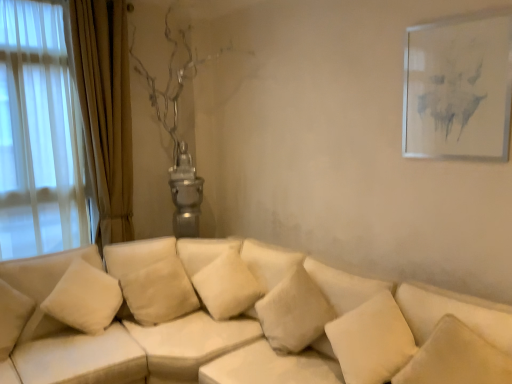
Question: Is soft beige cushion at center, which ranks as the third pillow in right-to-left order, taller than white fabric couch at center?

Choices:
 (A) yes
 (B) no

Answer: (B)

Question: Could you tell me if soft beige cushion at center, which ranks as the third pillow in right-to-left order, is turned towards white fabric couch at center?

Choices:
 (A) yes
 (B) no

Answer: (A)

Question: Is soft beige cushion at center, which ranks as the third pillow in right-to-left order, thinner than white fabric couch at center?

Choices:
 (A) yes
 (B) no

Answer: (A)

Question: Is soft beige cushion at center, which ranks as the third pillow in right-to-left order, looking in the opposite direction of white fabric couch at center?

Choices:
 (A) no
 (B) yes

Answer: (B)

Question: Is soft beige cushion at center, the 3th pillow viewed from the left, directly adjacent to white fabric couch at center?

Choices:
 (A) no
 (B) yes

Answer: (A)

Question: From the image's perspective, is white soft pillow at lower right, which is the fifth pillow from left to right, above or below white soft pillow at lower right, placed as the fourth pillow when sorted from left to right?

Choices:
 (A) above
 (B) below

Answer: (A)

Question: In the image, is white soft pillow at lower right, which is the fifth pillow from left to right, positioned in front of or behind white soft pillow at lower right, the second pillow from the right?

Choices:
 (A) front
 (B) behind

Answer: (A)

Question: From a real-world perspective, is white soft pillow at lower right, arranged as the 1th pillow when viewed from the right, physically located above or below white soft pillow at lower right, placed as the fourth pillow when sorted from left to right?

Choices:
 (A) below
 (B) above

Answer: (B)

Question: In the image, is white soft pillow at lower right, which is the fifth pillow from left to right, on the left side or the right side of white soft pillow at lower right, placed as the fourth pillow when sorted from left to right?

Choices:
 (A) right
 (B) left

Answer: (A)

Question: From the image's perspective, relative to white matte picture frame at upper right, is soft beige cushion at center, which ranks as the third pillow in right-to-left order, above or below?

Choices:
 (A) above
 (B) below

Answer: (B)

Question: Considering their positions, is soft beige cushion at center, the 3th pillow viewed from the left, located in front of or behind white matte picture frame at upper right?

Choices:
 (A) behind
 (B) front

Answer: (A)

Question: Do you think soft beige cushion at center, the 3th pillow viewed from the left, is within white matte picture frame at upper right, or outside of it?

Choices:
 (A) outside
 (B) inside

Answer: (A)

Question: In terms of width, does soft beige cushion at center, which ranks as the third pillow in right-to-left order, look wider or thinner when compared to white matte picture frame at upper right?

Choices:
 (A) wide
 (B) thin

Answer: (A)

Question: In the image, is white soft pillow at lower right, which is the fifth pillow from left to right, positioned in front of or behind white fabric couch at center?

Choices:
 (A) front
 (B) behind

Answer: (B)

Question: Considering the positions of point (435, 352) and point (507, 309), is point (435, 352) closer or farther from the camera than point (507, 309)?

Choices:
 (A) closer
 (B) farther

Answer: (A)